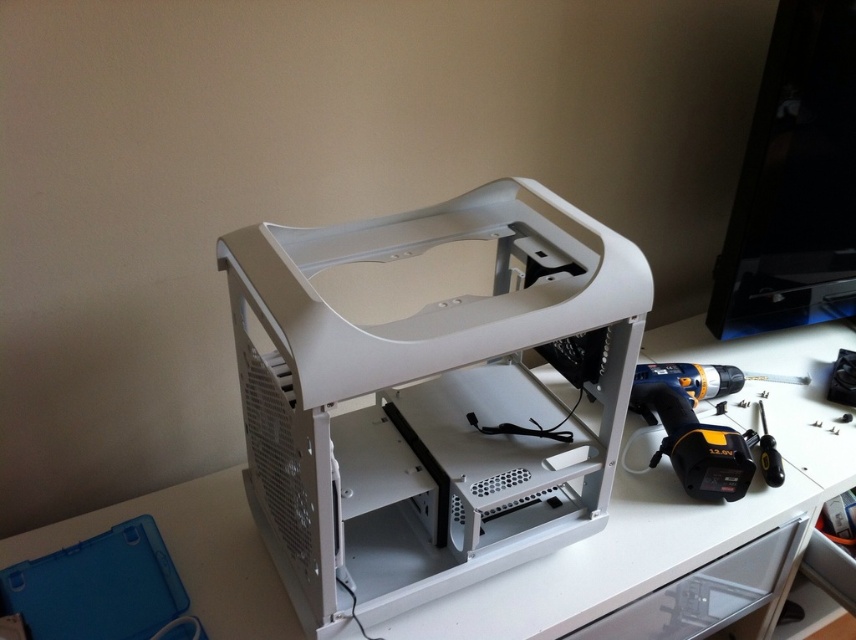
Question: Considering the real-world distances, which object is closest to the white plastic computer case at center?

Choices:
 (A) white plastic drawer at lower center
 (B) white plastic table at center

Answer: (B)

Question: Is white plastic table at center to the right of white plastic drawer at lower center from the viewer's perspective?

Choices:
 (A) no
 (B) yes

Answer: (A)

Question: Based on their relative distances, which object is nearer to the white plastic table at center?

Choices:
 (A) black plastic screwdriver at lower right
 (B) yellow/black plastic drill at right

Answer: (B)

Question: Does white plastic drawer at lower center have a greater width compared to black plastic screwdriver at lower right?

Choices:
 (A) yes
 (B) no

Answer: (A)

Question: Which point is closer to the camera?

Choices:
 (A) white plastic computer case at center
 (B) yellow/black plastic drill at right
 (C) white plastic drawer at lower center

Answer: (A)

Question: Is yellow/black plastic drill at right above black plastic screwdriver at lower right?

Choices:
 (A) yes
 (B) no

Answer: (A)